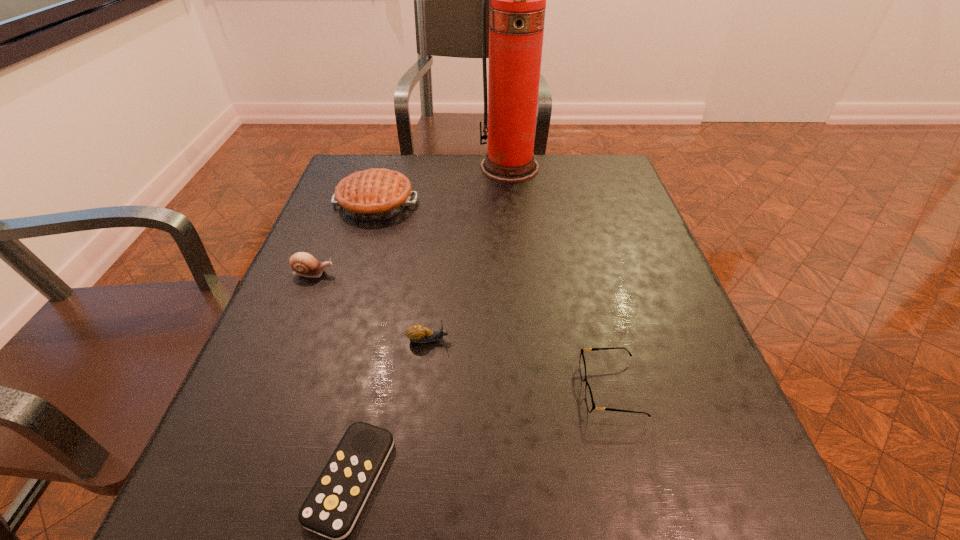
The image size is (960, 540). I want to click on fire extinguisher, so click(x=517, y=7).

At what (x,y) coordinates should I click in order to perform the action: click on the fifth object from left to right. Please return your answer as a coordinate pair (x, y). This screenshot has height=540, width=960. Looking at the image, I should click on (517, 7).

Find the location of a particular element. pie is located at coordinates (376, 194).

Find the location of `the fifth shortest object`. the fifth shortest object is located at coordinates (376, 194).

I want to click on the third tallest object, so click(x=304, y=264).

Find the location of a particular element. the fourth nearest object is located at coordinates (304, 264).

Identify the location of the right escargot. Image resolution: width=960 pixels, height=540 pixels. (x=417, y=333).

At what (x,y) coordinates should I click in order to perform the action: click on the third nearest object. Please return your answer as a coordinate pair (x, y). Looking at the image, I should click on (417, 333).

Image resolution: width=960 pixels, height=540 pixels. Find the location of `the fifth farthest object`. the fifth farthest object is located at coordinates (590, 403).

Locate an element on the screen. the rightmost object is located at coordinates (590, 403).